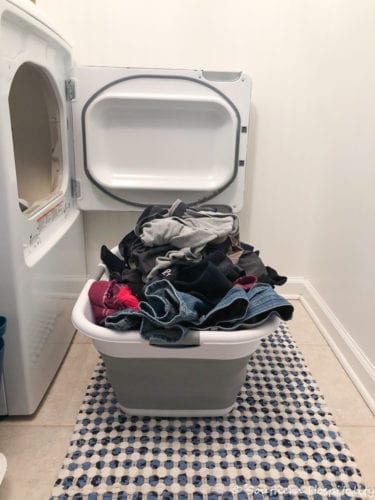
At what (x,y) coordinates should I click in order to perform the action: click on dryer door hinges. Please return your answer as a coordinate pair (x, y). The image size is (375, 500). Looking at the image, I should click on (66, 93), (76, 190).